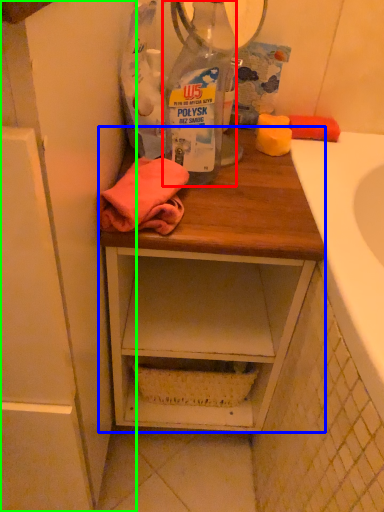
Question: Which object is positioned farthest from bottle (highlighted by a red box)? Select from desk (highlighted by a blue box) and cabinetry (highlighted by a green box).

Choices:
 (A) desk
 (B) cabinetry

Answer: (B)